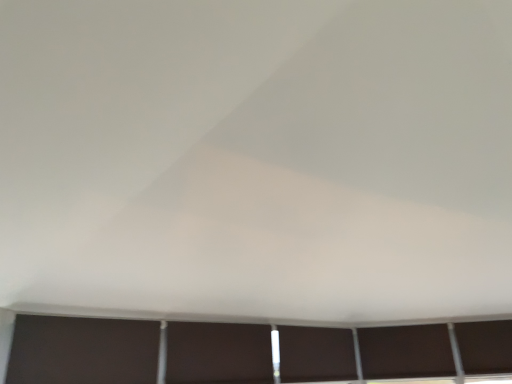
Question: Considering the relative positions of matte brown shutter at center, the first shutter positioned from the back, and dark matte window at bottom, positioned as the 3th window in right-to-left order, in the image provided, is matte brown shutter at center, the first shutter positioned from the back, to the right of dark matte window at bottom, positioned as the 3th window in right-to-left order, from the viewer's perspective?

Choices:
 (A) yes
 (B) no

Answer: (B)

Question: Can you confirm if matte brown shutter at center, the 2th shutter from the left, is bigger than dark matte window at bottom, positioned as the 3th window in right-to-left order?

Choices:
 (A) yes
 (B) no

Answer: (A)

Question: Can you confirm if matte brown shutter at center, the 2th shutter from the left, is smaller than dark matte window at bottom, positioned as the 3th window in right-to-left order?

Choices:
 (A) no
 (B) yes

Answer: (A)

Question: Can you confirm if matte brown shutter at center, which appears as the 2th shutter when viewed from the front, is thinner than dark matte window at bottom, positioned as the 3th window in right-to-left order?

Choices:
 (A) yes
 (B) no

Answer: (B)

Question: Would you say matte brown shutter at center, the 2th shutter from the left, contains dark matte window at bottom, the first window from the left?

Choices:
 (A) yes
 (B) no

Answer: (B)

Question: Is matte brown shutter at center, which appears as the 2th shutter when viewed from the front, facing away from dark matte window at bottom, the first window from the left?

Choices:
 (A) yes
 (B) no

Answer: (B)

Question: Is dark brown matte window at lower right, placed as the 1th window when sorted from right to left, at the right side of dark matte window at lower right, which ranks as the 2th window in right-to-left order?

Choices:
 (A) yes
 (B) no

Answer: (A)

Question: Is dark brown matte window at lower right, placed as the 1th window when sorted from right to left, thinner than dark matte window at lower right, which ranks as the 2th window in right-to-left order?

Choices:
 (A) no
 (B) yes

Answer: (B)

Question: Is dark brown matte window at lower right, placed as the 1th window when sorted from right to left, positioned before dark matte window at lower right, which ranks as the 2th window in left-to-right order?

Choices:
 (A) yes
 (B) no

Answer: (A)

Question: Can you confirm if dark brown matte window at lower right, placed as the 1th window when sorted from right to left, is shorter than dark matte window at lower right, which ranks as the 2th window in right-to-left order?

Choices:
 (A) yes
 (B) no

Answer: (B)

Question: Can you confirm if dark brown matte window at lower right, placed as the 1th window when sorted from right to left, is wider than dark matte window at lower right, which ranks as the 2th window in right-to-left order?

Choices:
 (A) yes
 (B) no

Answer: (B)

Question: From the image's perspective, does dark brown matte window at lower right, which is the 3th window from left to right, appear higher than dark matte window at lower right, which ranks as the 2th window in right-to-left order?

Choices:
 (A) yes
 (B) no

Answer: (A)

Question: Is dark matte window at lower right, which ranks as the 2th window in right-to-left order, facing away from dark brown matte window at lower right, which is the 3th window from left to right?

Choices:
 (A) no
 (B) yes

Answer: (A)